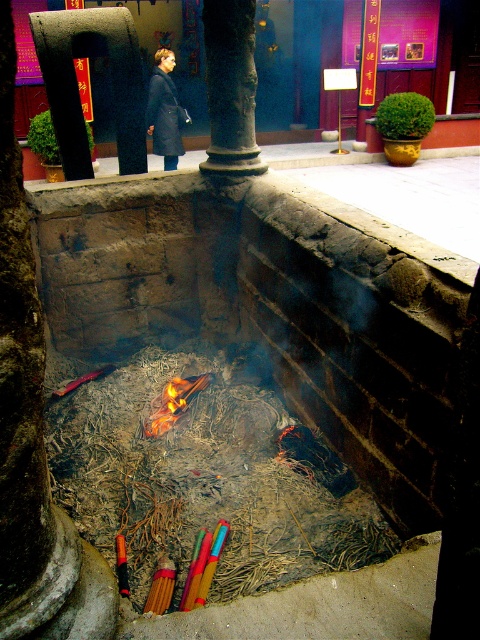
Is dark gray stone column at center taller than dark blue coat at center?

No.

Can you confirm if dark gray stone column at center is positioned above dark blue coat at center?

Incorrect, dark gray stone column at center is not positioned above dark blue coat at center.

Which is in front, point (212, 106) or point (149, 83)?

Positioned in front is point (212, 106).

This screenshot has width=480, height=640. I want to click on dark gray stone column at center, so click(230, 88).

Describe the element at coordinates (165, 109) in the screenshot. I see `dark blue coat at center` at that location.

Which is behind, point (145, 116) or point (151, 417)?

The point (145, 116) is behind.

At what (x,y) coordinates should I click in order to perform the action: click on dark blue coat at center. Please return your answer as a coordinate pair (x, y). This screenshot has width=480, height=640. Looking at the image, I should click on (165, 109).

Is dark gray stone column at center in front of flametransparentfire at center?

No.

Who is lower down, dark gray stone column at center or flametransparentfire at center?

flametransparentfire at center is below.

Identify the location of dark gray stone column at center. (230, 88).